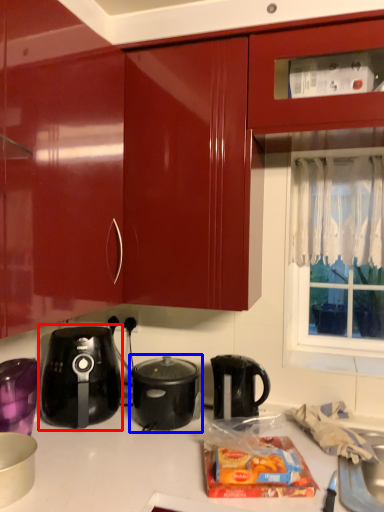
Question: Which object appears farthest to the camera in this image, kettle (highlighted by a red box) or kitchen appliance (highlighted by a blue box)?

Choices:
 (A) kettle
 (B) kitchen appliance

Answer: (B)